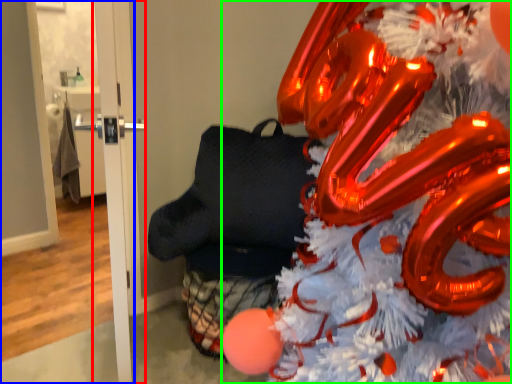
Question: Considering the real-world distances, which object is closest to door (highlighted by a red box)? door (highlighted by a blue box) or christmas tree (highlighted by a green box).

Choices:
 (A) door
 (B) christmas tree

Answer: (B)